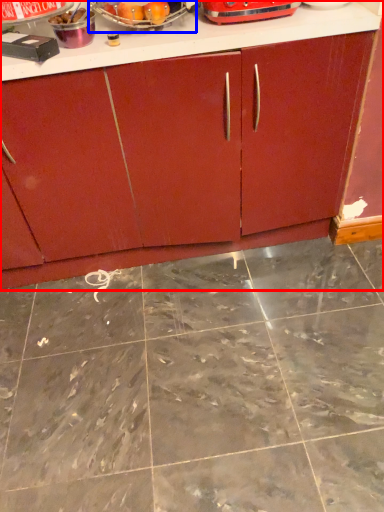
Question: Which object appears closest to the camera in this image, cabinetry (highlighted by a red box) or appliance (highlighted by a blue box)?

Choices:
 (A) cabinetry
 (B) appliance

Answer: (A)